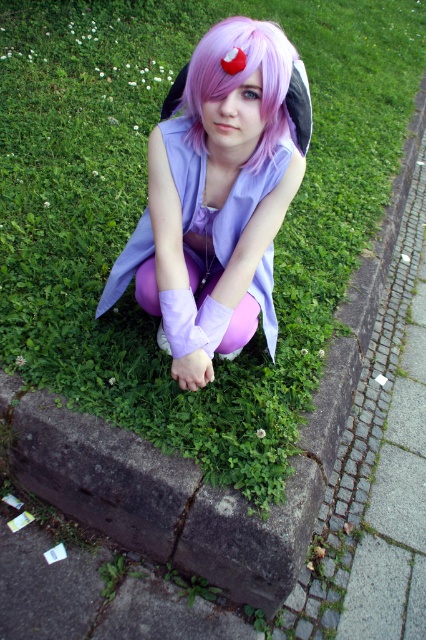
Is lavender fabric dress at center to the right of purple matte wig at center from the viewer's perspective?

No, lavender fabric dress at center is not to the right of purple matte wig at center.

Between lavender fabric dress at center and purple matte wig at center, which one appears on the left side from the viewer's perspective?

From the viewer's perspective, lavender fabric dress at center appears more on the left side.

Does point (238, 337) come behind point (242, 45)?

Yes, point (238, 337) is behind point (242, 45).

Where is `lavender fabric dress at center`? lavender fabric dress at center is located at coordinates click(x=216, y=198).